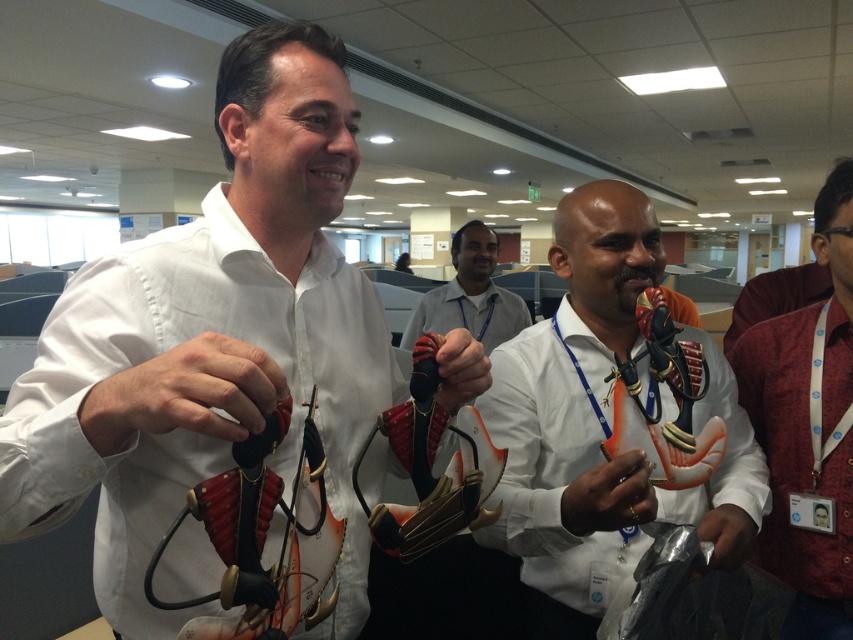
In the office scene with cubicles and fluorescent lights, you see an orange matte anatomical model at center and a matte white shirt at center. Which object is larger?

The orange matte anatomical model at center is smaller than the matte white shirt at center, so the matte white shirt at center is larger.

You are a healthcare professional in the office and need to access the orange matte anatomical model at center. Since the matte white shirt at center is covering it, can you move the shirt to get to the model?

The orange matte anatomical model at center is positioned under the matte white shirt at center, so yes, you can move the shirt to access the model.

Based on the photo, you are an office worker who needs to reach both the gold metallic ring at center and the metallic gray glove at lower right. Which object should you move towards first if you want to pick up the one closest to you?

The gold metallic ring at center is to the left of the metallic gray glove at lower right, so you should move towards the gold metallic ring at center first as it is closer to your current position.